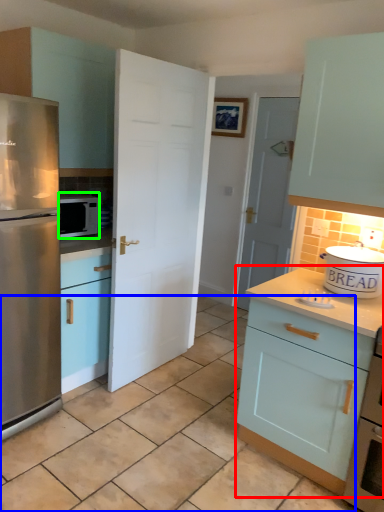
Question: Considering the real-world distances, which object is closest to cabinetry (highlighted by a red box)? tile (highlighted by a blue box) or microwave oven (highlighted by a green box).

Choices:
 (A) tile
 (B) microwave oven

Answer: (A)